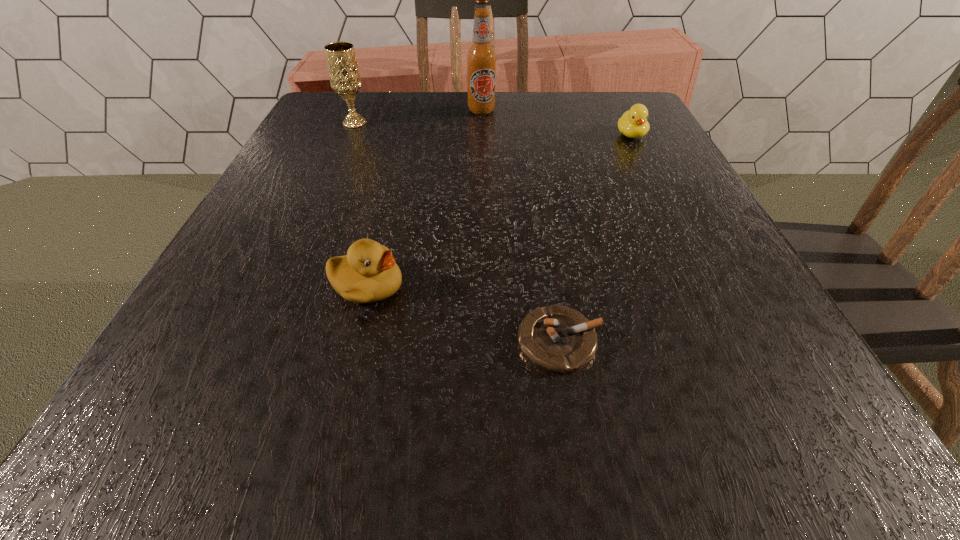
Locate an element on the screen. beer bottle is located at coordinates (481, 57).

This screenshot has width=960, height=540. I want to click on the tallest object, so click(x=481, y=57).

Locate an element on the screen. the second tallest object is located at coordinates (344, 75).

Find the location of `the leftmost object`. the leftmost object is located at coordinates (344, 75).

Where is `the left duckling`? The height and width of the screenshot is (540, 960). the left duckling is located at coordinates (368, 273).

Locate an element on the screen. Image resolution: width=960 pixels, height=540 pixels. the fourth object from right to left is located at coordinates (368, 273).

The width and height of the screenshot is (960, 540). In order to click on the second shortest object in this screenshot , I will do `click(633, 123)`.

Where is `the shorter duckling`? Image resolution: width=960 pixels, height=540 pixels. the shorter duckling is located at coordinates (633, 123).

I want to click on the shortest object, so [558, 339].

Find the location of `the fourth object from left to right`. the fourth object from left to right is located at coordinates (558, 339).